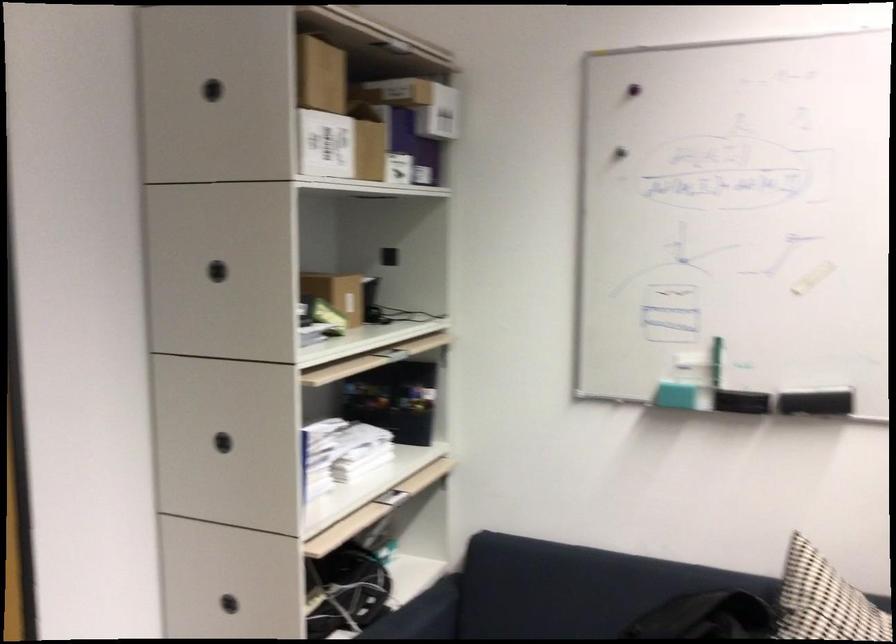
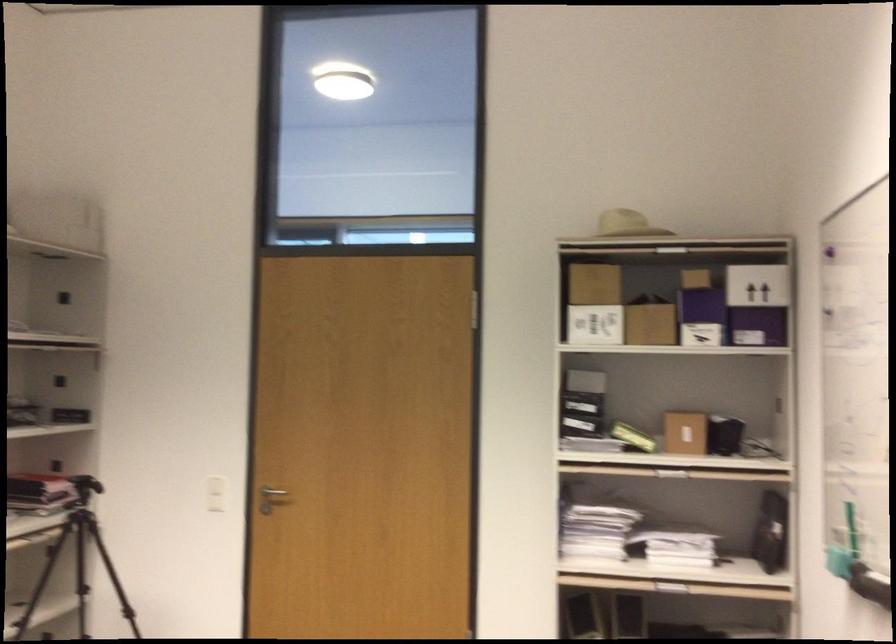
Find the pixel in the second image that matches (315,151) in the first image.

(595, 325)